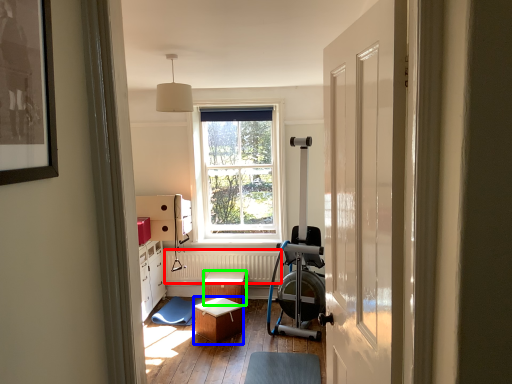
Question: Which object is the closest to the radiator (highlighted by a red box)? Choose among these: stool (highlighted by a blue box) or stool (highlighted by a green box).

Choices:
 (A) stool
 (B) stool

Answer: (B)